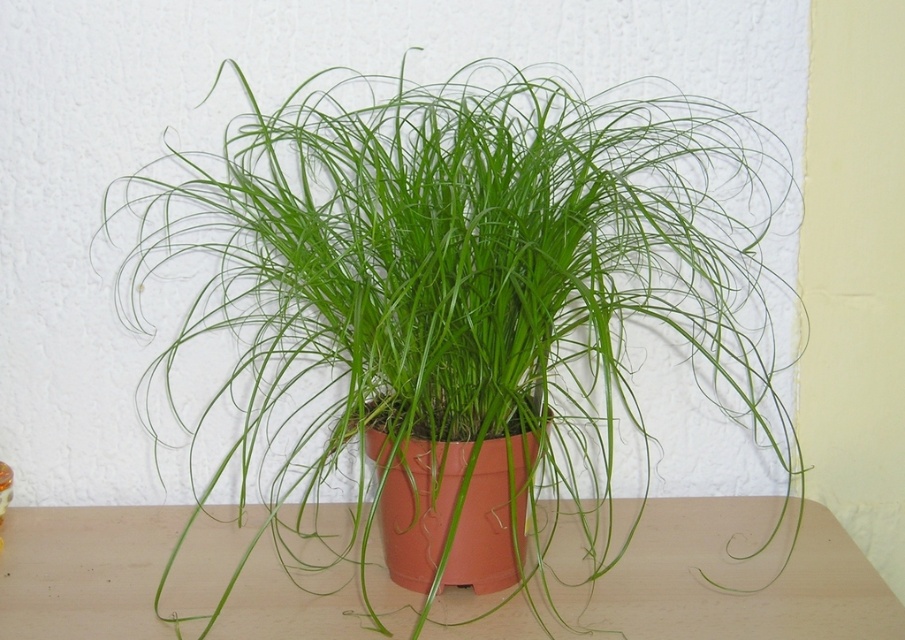
Question: Can you confirm if green glossy plant at center is positioned above matte orange pot at center?

Choices:
 (A) no
 (B) yes

Answer: (B)

Question: Is green glossy plant at center wider than matte orange pot at center?

Choices:
 (A) no
 (B) yes

Answer: (A)

Question: Does green glossy plant at center have a greater width compared to matte orange pot at center?

Choices:
 (A) no
 (B) yes

Answer: (A)

Question: Among these objects, which one is nearest to the camera?

Choices:
 (A) green glossy plant at center
 (B) matte orange pot at center

Answer: (A)

Question: Which point is closer to the camera?

Choices:
 (A) green glossy plant at center
 (B) matte orange pot at center

Answer: (A)